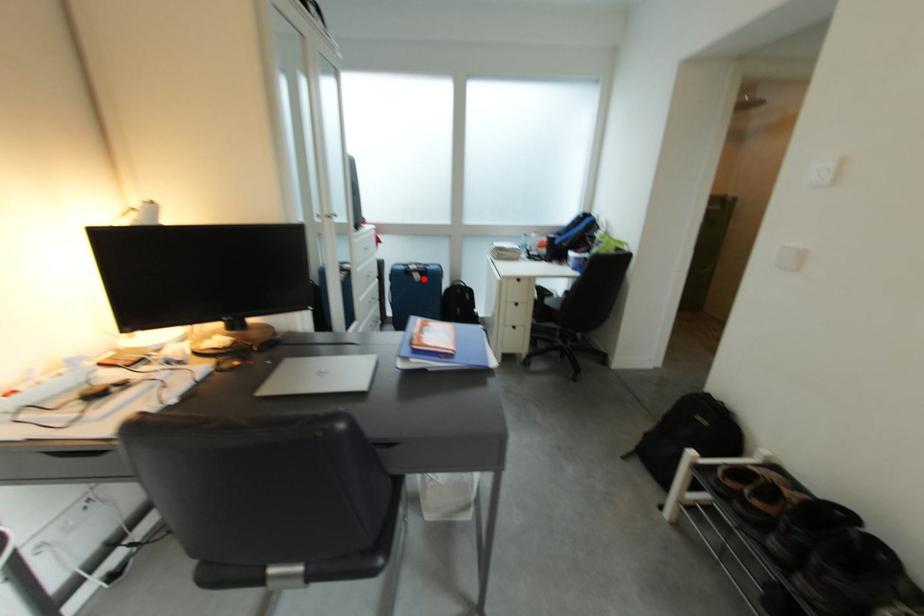
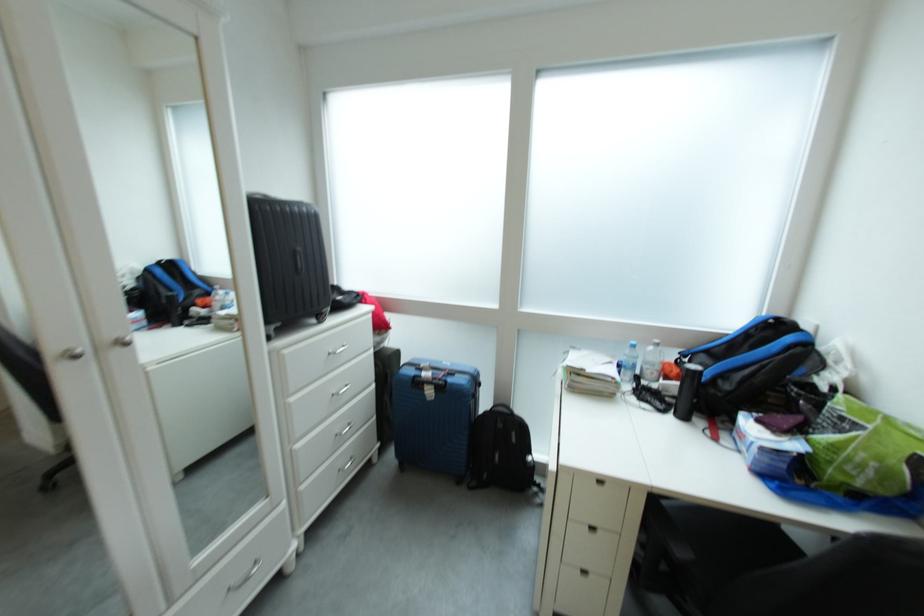
Where in the second image is the point corresponding to the highlighted location from the first image?

(434, 392)